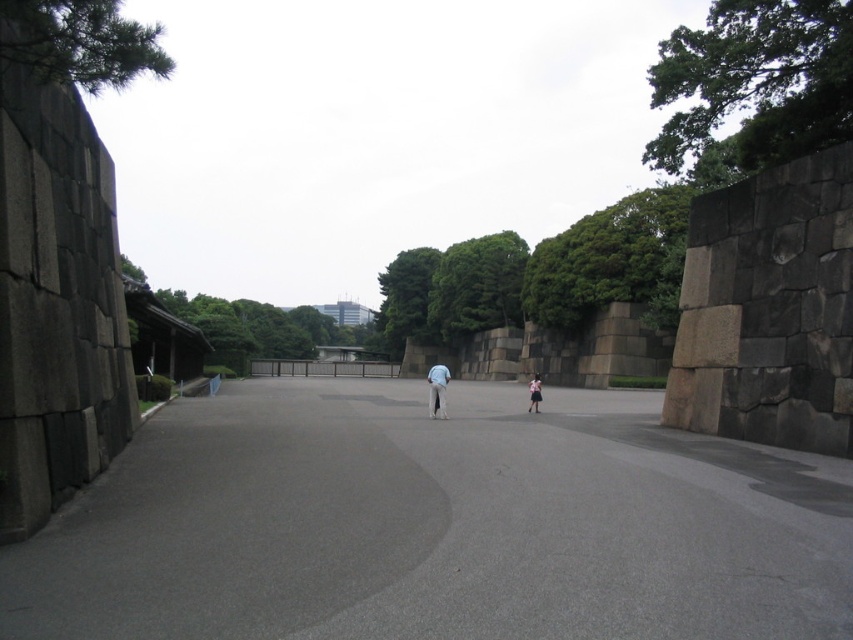
Is the position of gray asphalt pavement at center more distant than that of dark gray stone wall at right?

No, gray asphalt pavement at center is closer to the viewer.

Can you confirm if gray asphalt pavement at center is positioned to the right of dark gray stone wall at right?

In fact, gray asphalt pavement at center is to the left of dark gray stone wall at right.

Is point (706, 525) positioned in front of point (824, 374)?

Yes, point (706, 525) is closer to viewer.

The image size is (853, 640). I want to click on gray asphalt pavement at center, so (x=436, y=524).

Between point (695, 472) and point (444, 404), which one is positioned behind?

Point (444, 404)

Is gray asphalt pavement at center below light blue fabric pants at center?

Actually, gray asphalt pavement at center is above light blue fabric pants at center.

Where is `gray asphalt pavement at center`? The width and height of the screenshot is (853, 640). gray asphalt pavement at center is located at coordinates (436, 524).

Between light blue fabric pants at center and light blue fabric at center, which one is positioned lower?

light blue fabric pants at center is lower down.

Can you confirm if light blue fabric pants at center is taller than light blue fabric at center?

Correct, light blue fabric pants at center is much taller as light blue fabric at center.

Where is `light blue fabric pants at center`? light blue fabric pants at center is located at coordinates click(x=437, y=388).